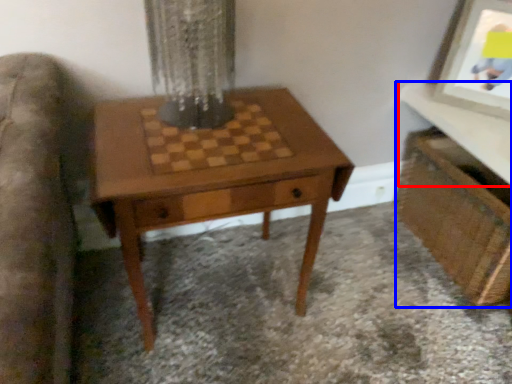
Question: Which point is further to the camera, table top (highlighted by a red box) or vanity (highlighted by a blue box)?

Choices:
 (A) table top
 (B) vanity

Answer: (B)